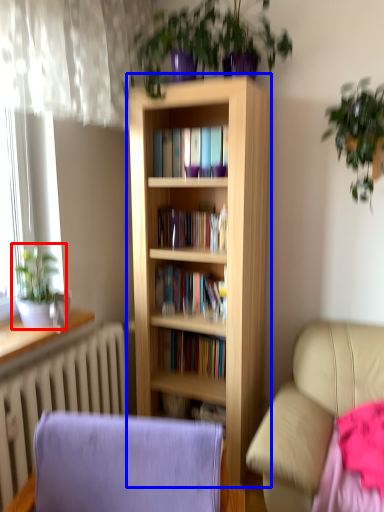
Question: Among these objects, which one is nearest to the camera, houseplant (highlighted by a red box) or bookcase (highlighted by a blue box)?

Choices:
 (A) houseplant
 (B) bookcase

Answer: (A)